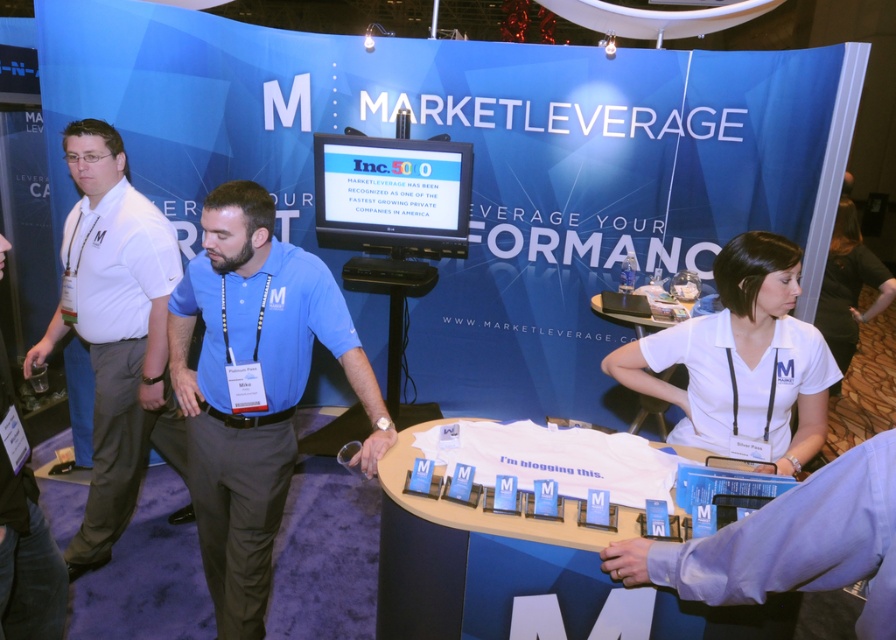
Question: Which point is closer to the camera?

Choices:
 (A) white cotton shirt at left
 (B) blue cotton shirt at center
 (C) white matte shirt at center

Answer: (C)

Question: Can you confirm if white cotton shirt at left is positioned below white fabric shirt at right?

Choices:
 (A) no
 (B) yes

Answer: (B)

Question: Is white cotton shirt at left behind black shirt at left?

Choices:
 (A) yes
 (B) no

Answer: (A)

Question: Which point appears closest to the camera in this image?

Choices:
 (A) (92, 422)
 (B) (306, 262)

Answer: (B)

Question: Estimate the real-world distances between objects in this image. Which object is closer to the white fabric shirt at right?

Choices:
 (A) white matte shirt at center
 (B) white cotton shirt at left
 (C) blue cotton shirt at center

Answer: (A)

Question: Can you confirm if white cotton shirt at left is wider than white matte shirt at center?

Choices:
 (A) yes
 (B) no

Answer: (B)